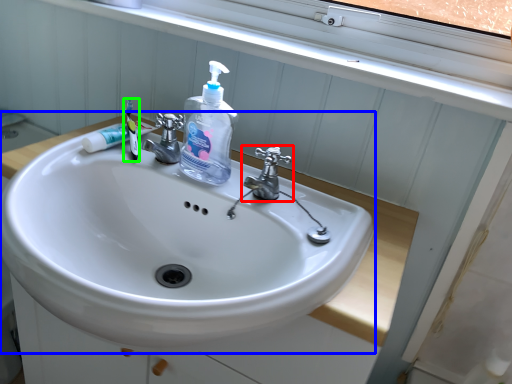
Question: Based on their relative distances, which object is farther from tap (highlighted by a red box)? Choose from sink (highlighted by a blue box) and toothbrush (highlighted by a green box).

Choices:
 (A) sink
 (B) toothbrush

Answer: (B)